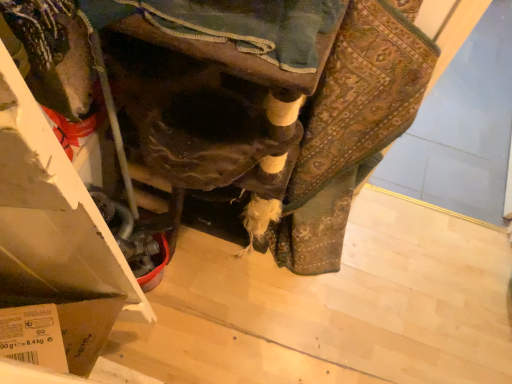
Identify the location of matte cardboard box at lower left. (52, 212).

This screenshot has height=384, width=512. What do you see at coordinates (52, 212) in the screenshot?
I see `matte cardboard box at lower left` at bounding box center [52, 212].

Where is `matte cardboard box at lower left`? The width and height of the screenshot is (512, 384). matte cardboard box at lower left is located at coordinates (52, 212).